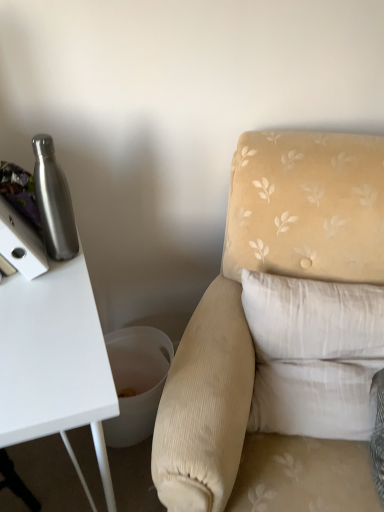
Question: Is velvet beige armchair at center to the right of white cotton pillow at right from the viewer's perspective?

Choices:
 (A) yes
 (B) no

Answer: (B)

Question: Does velvet beige armchair at center have a lesser width compared to white cotton pillow at right?

Choices:
 (A) yes
 (B) no

Answer: (B)

Question: Could you tell me if velvet beige armchair at center is turned towards white cotton pillow at right?

Choices:
 (A) no
 (B) yes

Answer: (B)

Question: Is velvet beige armchair at center positioned behind white cotton pillow at right?

Choices:
 (A) yes
 (B) no

Answer: (B)

Question: Is velvet beige armchair at center oriented away from white cotton pillow at right?

Choices:
 (A) yes
 (B) no

Answer: (A)

Question: From a real-world perspective, is velvet beige armchair at center positioned under white cotton pillow at right based on gravity?

Choices:
 (A) yes
 (B) no

Answer: (A)

Question: From a real-world perspective, is white cotton pillow at right physically below brushed metal water bottle at left?

Choices:
 (A) no
 (B) yes

Answer: (B)

Question: Does white cotton pillow at right have a greater height compared to brushed metal water bottle at left?

Choices:
 (A) yes
 (B) no

Answer: (A)

Question: Does white cotton pillow at right appear on the right side of brushed metal water bottle at left?

Choices:
 (A) no
 (B) yes

Answer: (B)

Question: Is white cotton pillow at right closer to the viewer compared to brushed metal water bottle at left?

Choices:
 (A) no
 (B) yes

Answer: (B)

Question: Is white cotton pillow at right to the left of brushed metal water bottle at left from the viewer's perspective?

Choices:
 (A) yes
 (B) no

Answer: (B)

Question: From the image's perspective, is white cotton pillow at right above brushed metal water bottle at left?

Choices:
 (A) no
 (B) yes

Answer: (A)

Question: From the image's perspective, is brushed metal water bottle at left below velvet beige armchair at center?

Choices:
 (A) no
 (B) yes

Answer: (A)